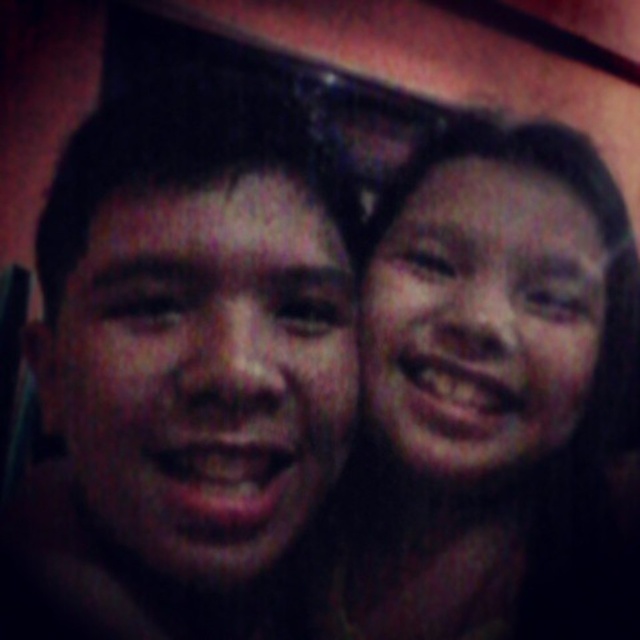
Is smooth skin at right shorter than smooth skin face at center?

No, smooth skin at right is not shorter than smooth skin face at center.

Who is lower down, smooth skin at right or smooth skin face at center?

smooth skin at right

At what (x,y) coordinates should I click in order to perform the action: click on smooth skin at right. Please return your answer as a coordinate pair (x, y). This screenshot has height=640, width=640. Looking at the image, I should click on (484, 396).

Identify the location of smooth skin at right. (484, 396).

Between point (608, 417) and point (577, 394), which one is positioned in front?

Positioned in front is point (577, 394).

Can you confirm if smooth skin at right is shorter than smooth skin face at right?

Incorrect, smooth skin at right's height does not fall short of smooth skin face at right's.

Between point (513, 483) and point (461, 326), which one is positioned behind?

Point (513, 483)

Where is `smooth skin at right`? This screenshot has height=640, width=640. smooth skin at right is located at coordinates (484, 396).

Which is more to the left, smooth skin face at center or smooth skin face at right?

smooth skin face at center

Can you confirm if smooth skin face at center is thinner than smooth skin face at right?

Correct, smooth skin face at center's width is less than smooth skin face at right's.

Is point (198, 195) positioned behind point (531, 326)?

No, (198, 195) is in front of (531, 326).

I want to click on smooth skin face at center, so click(x=205, y=369).